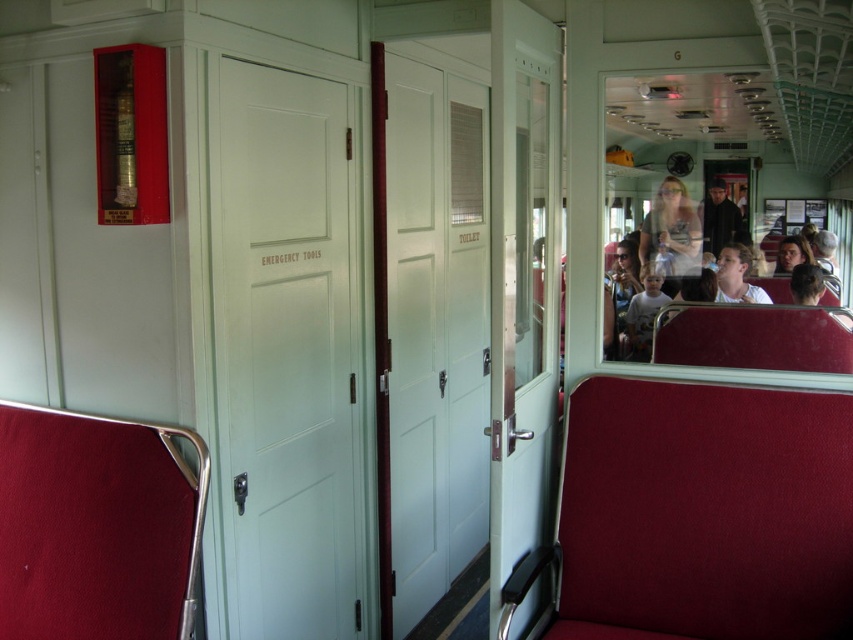
Can you confirm if light gray t-shirt at center is positioned to the right of dark gray fabric coach at center?

→ No, light gray t-shirt at center is not to the right of dark gray fabric coach at center.

In the scene shown: Does light gray t-shirt at center have a smaller size compared to dark gray fabric coach at center?

No, light gray t-shirt at center is not smaller than dark gray fabric coach at center.

Image resolution: width=853 pixels, height=640 pixels. In order to click on light gray t-shirt at center in this screenshot , I will do `click(643, 310)`.

The width and height of the screenshot is (853, 640). I want to click on light gray t-shirt at center, so click(x=643, y=310).

Is matte black jacket at upper right to the right of light gray t-shirt at center from the viewer's perspective?

Yes, matte black jacket at upper right is to the right of light gray t-shirt at center.

Where is `matte black jacket at upper right`? The width and height of the screenshot is (853, 640). matte black jacket at upper right is located at coordinates click(671, 230).

Can you confirm if matte black jacket at upper right is taller than smooth brown hair at right?

Yes, matte black jacket at upper right is taller than smooth brown hair at right.

Is matte black jacket at upper right wider than smooth brown hair at right?

Correct, the width of matte black jacket at upper right exceeds that of smooth brown hair at right.

Is point (683, 216) positioned before point (811, 260)?

No, it is not.

Locate an element on the screen. matte black jacket at upper right is located at coordinates (671, 230).